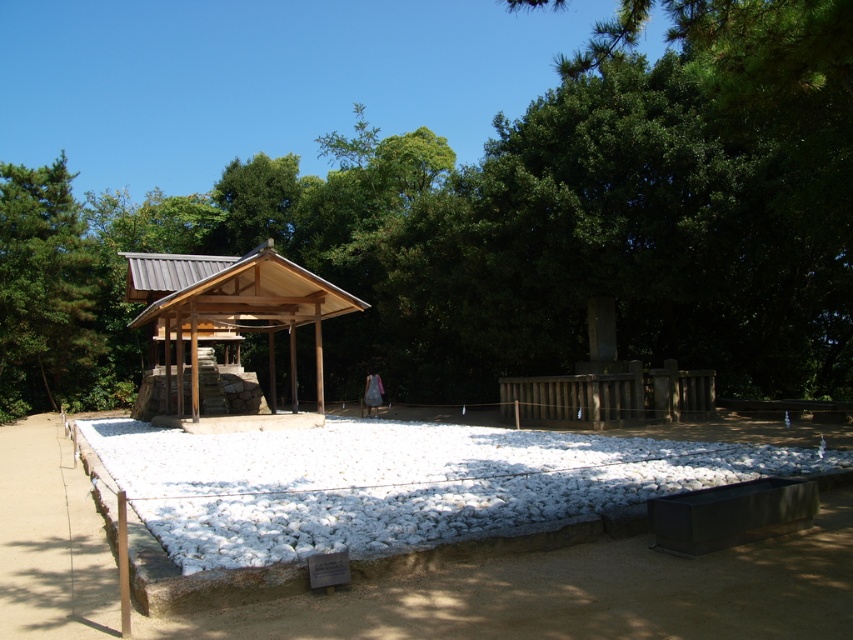
You are a visitor standing at the entrance of the historical site. You see the green leafy tree at upper center and the wooden gazebo at center. Which object is larger in size?

The green leafy tree at upper center is bigger than the wooden gazebo at center.

You are standing in the historical site and want to take a photo of the wooden gazebo at center. To ensure the green leafy tree at upper center doesn not block the view, should you position yourself to the left or right of the gazebo?

You should position yourself to the left of the wooden gazebo at center because the green leafy tree at upper center is located to the right of it, so standing on the left side would avoid the tree blocking the view.

You are a visitor at this historical site and want to take a photo of both the green leafy tree at upper center and the wooden gazebo at center. Based on their sizes, which one should you zoom in on more to ensure both fit in the frame?

Since the green leafy tree at upper center is wider than the wooden gazebo at center, you should zoom in more on the tree to accommodate its larger width while still capturing the gazebo in the frame.